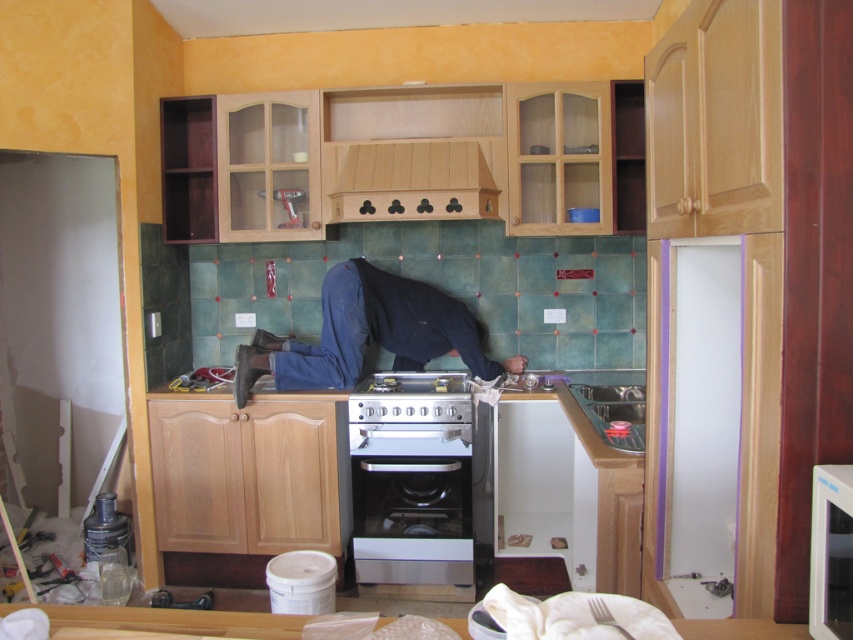
Question: From the image, what is the correct spatial relationship of blue denim jeans at center in relation to wooden exhaust hood at upper center?

Choices:
 (A) left
 (B) right

Answer: (A)

Question: Considering the real-world distances, which object is closest to the satin silver oven at center?

Choices:
 (A) silver metallic gas stove at center
 (B) blue denim jeans at center

Answer: (A)

Question: Is satin silver oven at center to the left of white glossy microwave at upper right from the viewer's perspective?

Choices:
 (A) no
 (B) yes

Answer: (B)

Question: Among these objects, which one is farthest from the camera?

Choices:
 (A) white glossy microwave at upper right
 (B) satin silver oven at center
 (C) silver metallic gas stove at center

Answer: (B)

Question: Which of the following is the closest to the observer?

Choices:
 (A) (463, 145)
 (B) (410, 412)
 (C) (625, 401)

Answer: (C)

Question: Does wooden exhaust hood at upper center come in front of matte stainless steel sink at lower right?

Choices:
 (A) yes
 (B) no

Answer: (B)